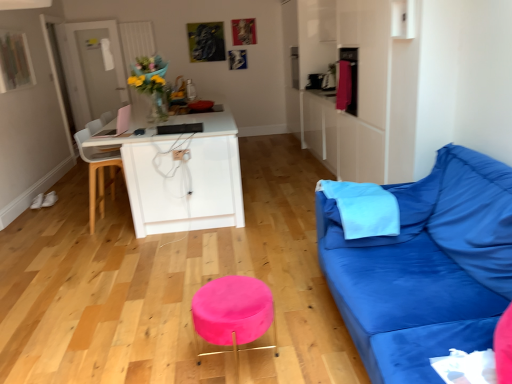
Question: Is blue fabric pillow at right, which ranks as the 1th pillow in right-to-left order, aimed at blue fabric couch at right?

Choices:
 (A) no
 (B) yes

Answer: (B)

Question: Can you confirm if blue fabric pillow at right, the 2th pillow positioned from the left, is thinner than blue fabric couch at right?

Choices:
 (A) yes
 (B) no

Answer: (A)

Question: Is blue fabric pillow at right, the 2th pillow positioned from the left, not near blue fabric couch at right?

Choices:
 (A) no
 (B) yes

Answer: (A)

Question: From a real-world perspective, is blue fabric pillow at right, which ranks as the 1th pillow in right-to-left order, positioned over blue fabric couch at right based on gravity?

Choices:
 (A) yes
 (B) no

Answer: (A)

Question: From the image's perspective, is blue fabric pillow at right, the 2th pillow positioned from the left, below blue fabric couch at right?

Choices:
 (A) no
 (B) yes

Answer: (A)

Question: Can you confirm if blue fabric pillow at right, which ranks as the 1th pillow in right-to-left order, is positioned to the right of blue fabric couch at right?

Choices:
 (A) no
 (B) yes

Answer: (A)

Question: Is blue fabric pillow at right, the 2th pillow positioned from the left, next to pink velvet stool at center?

Choices:
 (A) yes
 (B) no

Answer: (B)

Question: Does blue fabric pillow at right, the 2th pillow positioned from the left, come behind pink velvet stool at center?

Choices:
 (A) yes
 (B) no

Answer: (A)

Question: Is blue fabric pillow at right, which ranks as the 1th pillow in right-to-left order, thinner than pink velvet stool at center?

Choices:
 (A) yes
 (B) no

Answer: (A)

Question: Can pink velvet stool at center be found inside blue fabric pillow at right, the 2th pillow positioned from the left?

Choices:
 (A) yes
 (B) no

Answer: (B)

Question: Is blue fabric pillow at right, the 2th pillow positioned from the left, shorter than pink velvet stool at center?

Choices:
 (A) no
 (B) yes

Answer: (A)

Question: Is blue fabric pillow at right, which ranks as the 1th pillow in right-to-left order, to the left of pink velvet stool at center from the viewer's perspective?

Choices:
 (A) no
 (B) yes

Answer: (A)

Question: From the image's perspective, does white plastic chair at left appear higher than light blue fabric pillow at right, arranged as the 1th pillow when viewed from the left?

Choices:
 (A) no
 (B) yes

Answer: (B)